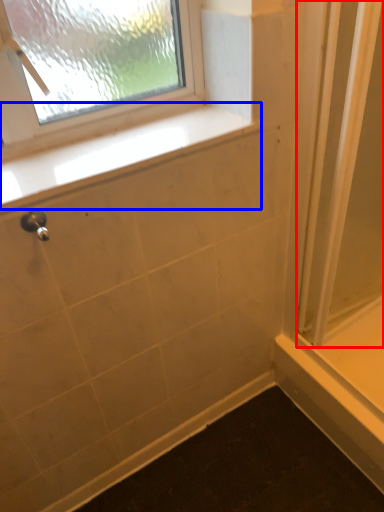
Question: Among these objects, which one is nearest to the camera, screen door (highlighted by a red box) or window sill (highlighted by a blue box)?

Choices:
 (A) screen door
 (B) window sill

Answer: (B)